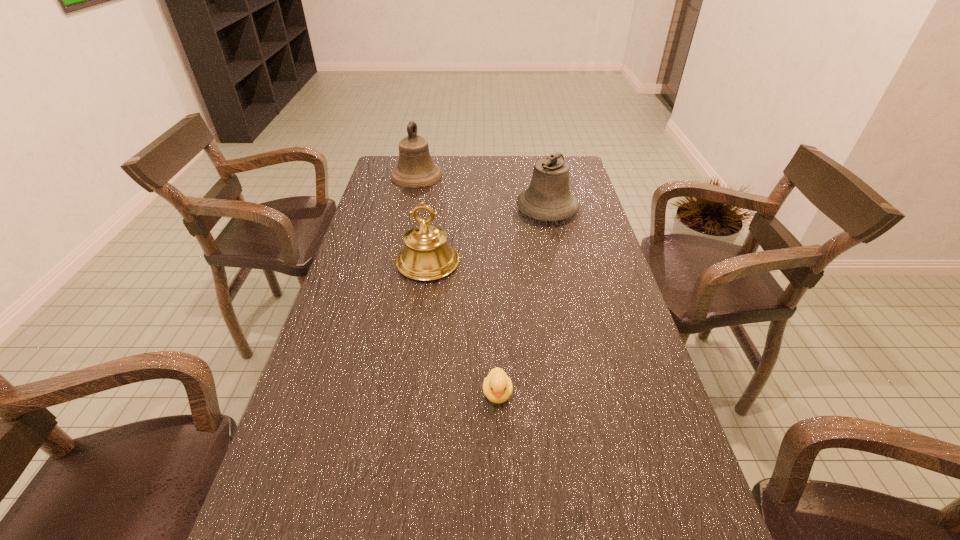
Locate an element on the screen. This screenshot has height=540, width=960. the farthest object is located at coordinates (415, 169).

I want to click on the nearest bell, so click(427, 256).

Find the location of a particular element. the rightmost object is located at coordinates (548, 198).

What are the coordinates of `the second farthest object` in the screenshot? It's located at (548, 198).

Locate an element on the screen. duckling is located at coordinates (497, 386).

Find the location of a particular element. This screenshot has width=960, height=540. the shortest object is located at coordinates (497, 386).

I want to click on vacant space located on the front of the farthest object, so click(399, 252).

Locate an element on the screen. Image resolution: width=960 pixels, height=540 pixels. free space located on the back of the nearest bell is located at coordinates (439, 186).

The height and width of the screenshot is (540, 960). Find the location of `free location located 0.180m on the left of the rightmost object`. free location located 0.180m on the left of the rightmost object is located at coordinates (465, 210).

Identify the location of free space located 0.060m on the beak of the shortest object. (499, 436).